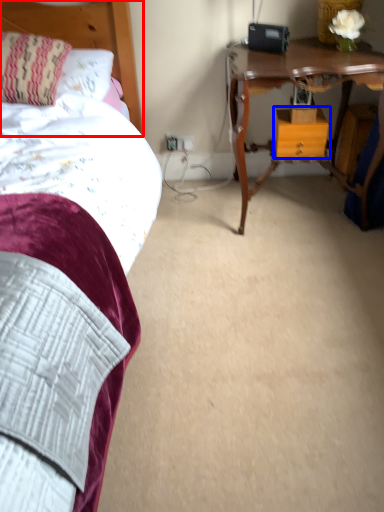
Question: Which point is closer to the camera, headboard (highlighted by a red box) or nightstand (highlighted by a blue box)?

Choices:
 (A) headboard
 (B) nightstand

Answer: (A)